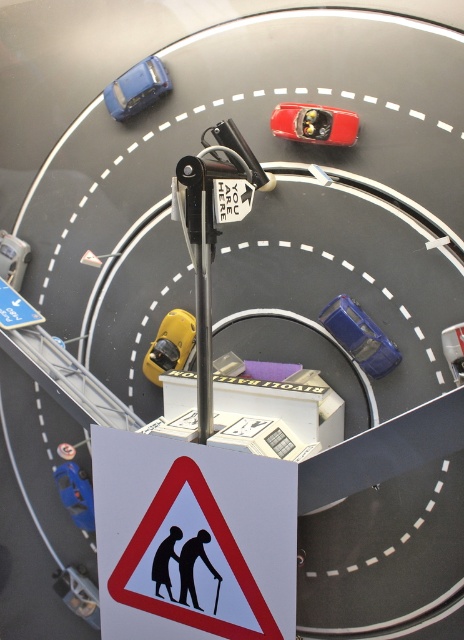
Does matte blue car at upper left appear on the left side of yellow rubber toy car at center?

Correct, you'll find matte blue car at upper left to the left of yellow rubber toy car at center.

Is point (161, 67) closer to viewer compared to point (194, 330)?

Yes, it is in front of point (194, 330).

Identify the location of matte blue car at upper left. This screenshot has height=640, width=464. (136, 88).

You are a GUI agent. You are given a task and a screenshot of the screen. Output one action in this format:
    pyautogui.click(x=<x>, y=<y>)
    Task: Click on the matte blue car at upper left
    The image size is (464, 640).
    Given the screenshot: What is the action you would take?
    pyautogui.click(x=136, y=88)

Does point (315, 129) lie behind point (153, 70)?

No, it is in front of (153, 70).

Does shiny red car at upper center have a smaller size compared to matte blue car at upper left?

Yes, shiny red car at upper center is smaller than matte blue car at upper left.

Is point (290, 134) more distant than point (150, 67)?

No, it is in front of (150, 67).

I want to click on shiny red car at upper center, so click(x=315, y=124).

Can you confirm if yellow rubber toy car at center is positioned above blue plastic toy car at lower left?

Indeed, yellow rubber toy car at center is positioned over blue plastic toy car at lower left.

Is point (176, 342) behind point (77, 474)?

No, (176, 342) is closer to viewer.

Is point (182, 356) closer to camera compared to point (64, 481)?

Yes, point (182, 356) is closer to viewer.

Locate an element on the screen. This screenshot has height=640, width=464. yellow rubber toy car at center is located at coordinates (169, 344).